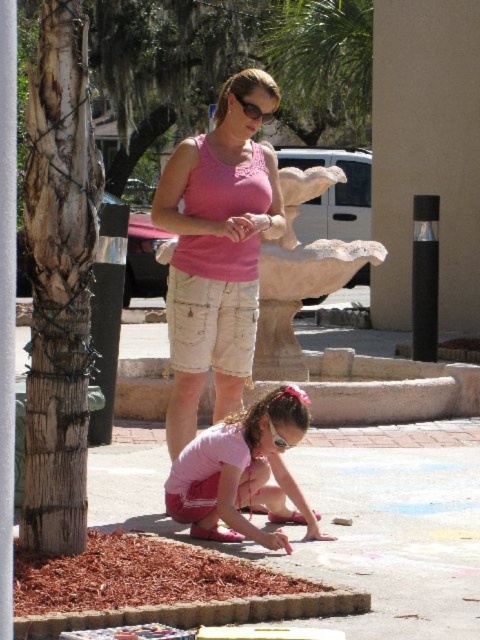
Looking at the woman in the scene, which piece of clothing is located above the other between her pink cotton tank top at center and her pink fabric shorts at lower center?

The pink cotton tank top at center is positioned over the pink fabric shorts at lower center.

You are an observer looking at the scene. Which object is larger between the pink cotton tank top at center and the green leafy palm tree at upper center?

The green leafy palm tree at upper center is larger than the pink cotton tank top at center.

Looking at this image, you are a photographer standing in front of the scene. You want to capture a photo that includes both the pink fabric shorts at lower center and the green leafy palm tree at upper center. Which object should you focus on first to ensure both are in the frame?

The pink fabric shorts at lower center has a smaller size compared to green leafy palm tree at upper center. To include both in the frame, focus on positioning the camera so that the smaller pink fabric shorts at lower center is centered first, then adjust to include the larger green leafy palm tree at upper center.